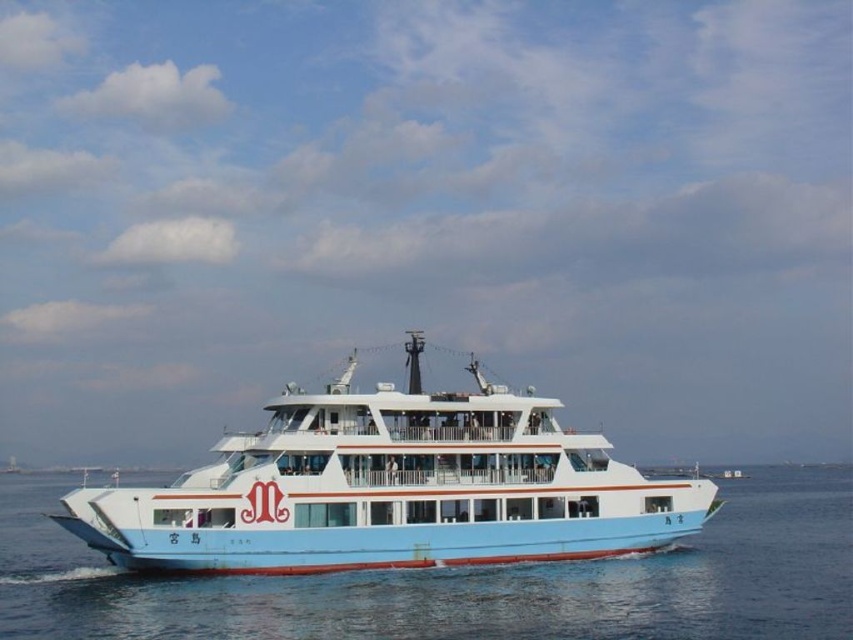
Where is `light blue plastic boat at center`? light blue plastic boat at center is located at coordinates [392, 488].

Which of these two, light blue plastic boat at center or blue water at center, stands taller?

light blue plastic boat at center

Where is `light blue plastic boat at center`? light blue plastic boat at center is located at coordinates click(392, 488).